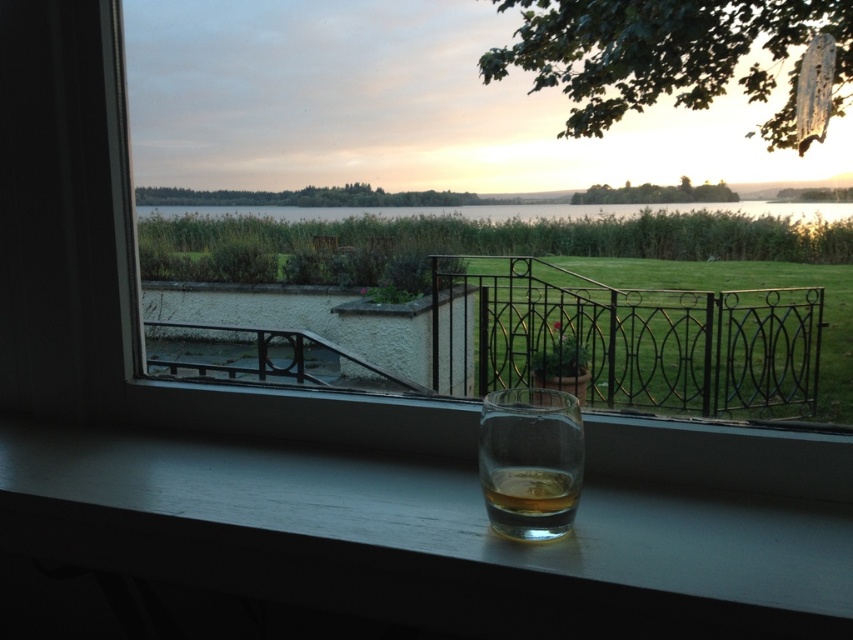
Question: Where is smooth wood window sill at lower center located in relation to green grass at lower center in the image?

Choices:
 (A) left
 (B) right

Answer: (A)

Question: Is black wrought iron railing at center bigger than translucent glass at window?

Choices:
 (A) no
 (B) yes

Answer: (B)

Question: Which point appears farthest from the camera in this image?

Choices:
 (A) (554, 483)
 (B) (593, 376)
 (C) (184, 547)

Answer: (B)

Question: Which point is closer to the camera?

Choices:
 (A) translucent glass at lower center
 (B) black wrought iron railing at center

Answer: (A)

Question: Which point appears farthest from the camera in this image?

Choices:
 (A) (581, 337)
 (B) (483, 400)
 (C) (538, 477)

Answer: (A)

Question: Does smooth wood window sill at lower center appear on the right side of transparent glass at center?

Choices:
 (A) yes
 (B) no

Answer: (B)